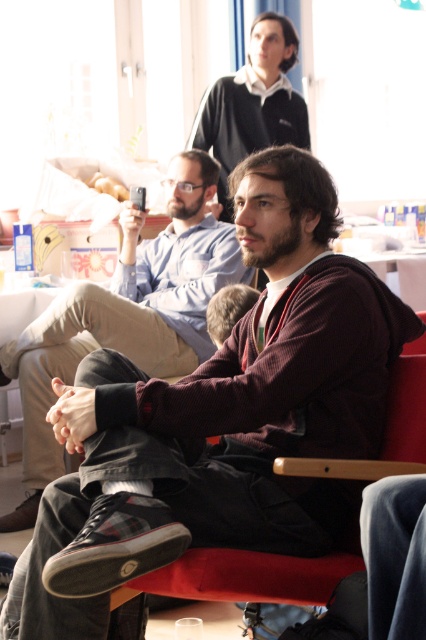
Question: Which object is positioned farthest from the dark brown corduroy pants at center?

Choices:
 (A) velvet-like fabric armchair at center
 (B) dark blue sweater at upper center

Answer: (A)

Question: Is dark brown corduroy pants at center above dark blue sweater at upper center?

Choices:
 (A) yes
 (B) no

Answer: (B)

Question: Among these objects, which one is farthest from the camera?

Choices:
 (A) dark blue sweater at upper center
 (B) velvet-like fabric armchair at center

Answer: (A)

Question: Is velvet-like fabric armchair at center positioned before dark blue sweater at upper center?

Choices:
 (A) yes
 (B) no

Answer: (A)

Question: Is dark brown corduroy pants at center to the right of dark blue sweater at upper center from the viewer's perspective?

Choices:
 (A) yes
 (B) no

Answer: (B)

Question: Which point appears farthest from the camera in this image?

Choices:
 (A) (417, 428)
 (B) (138, 310)

Answer: (B)